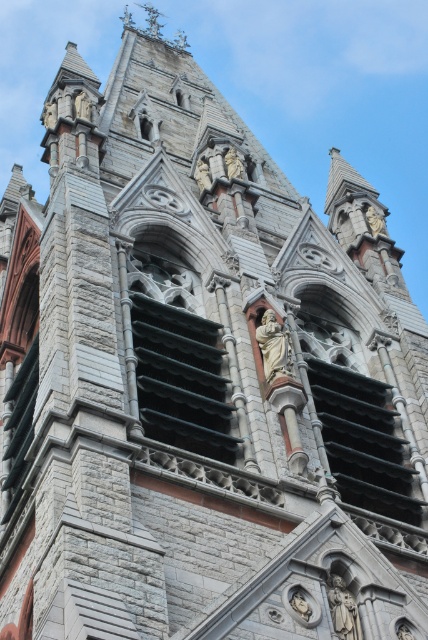
You are an architect designing a new Gothic cathedral and want to place a new statue in the same location as the gold statue at upper right. What are the coordinates of that position?

The coordinates of the gold statue at upper right are at point (374, 221).

You are standing in front of the Gothic cathedral and want to touch the statues. Which statue, the polished stone statue at center or the gold statue at upper right, can you reach without moving your position?

The polished stone statue at center is closer to the viewer than the gold statue at upper right, so you can reach the polished stone statue at center without moving your position.

You are an art historian examining the facade of the Gothic cathedral. You notice two statues, the polished stone statue at center and the gold statue at upper right. Which statue is located to the left of the other?

The polished stone statue at center is positioned on the left side of gold statue at upper right.